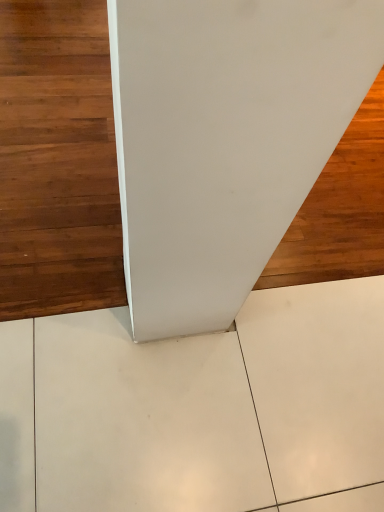
This screenshot has height=512, width=384. I want to click on wooden floor at left, so click(x=57, y=161).

Describe the element at coordinates (57, 161) in the screenshot. I see `wooden floor at left` at that location.

Identify the location of wooden floor at left. (57, 161).